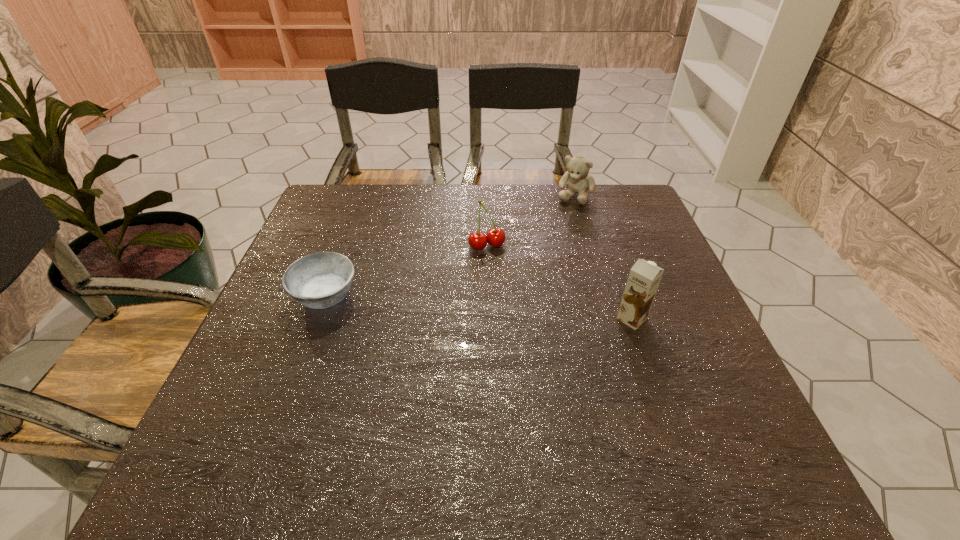
The width and height of the screenshot is (960, 540). Find the location of `free space that satisfies the following two spatial constraints: 1. on the back side of the ashtray; 2. on the left side of the teddy bear`. free space that satisfies the following two spatial constraints: 1. on the back side of the ashtray; 2. on the left side of the teddy bear is located at coordinates (363, 195).